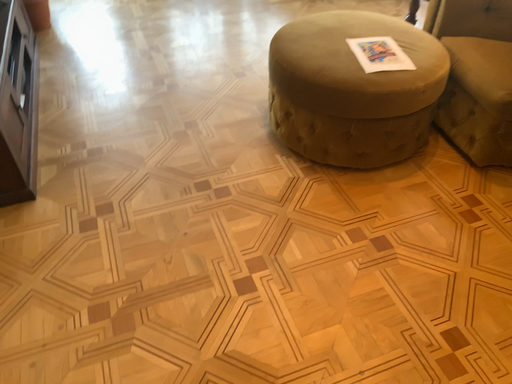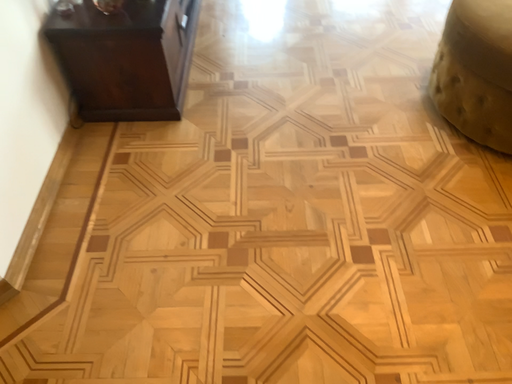
Question: Which way did the camera rotate in the video?

Choices:
 (A) rotated right
 (B) rotated left

Answer: (B)